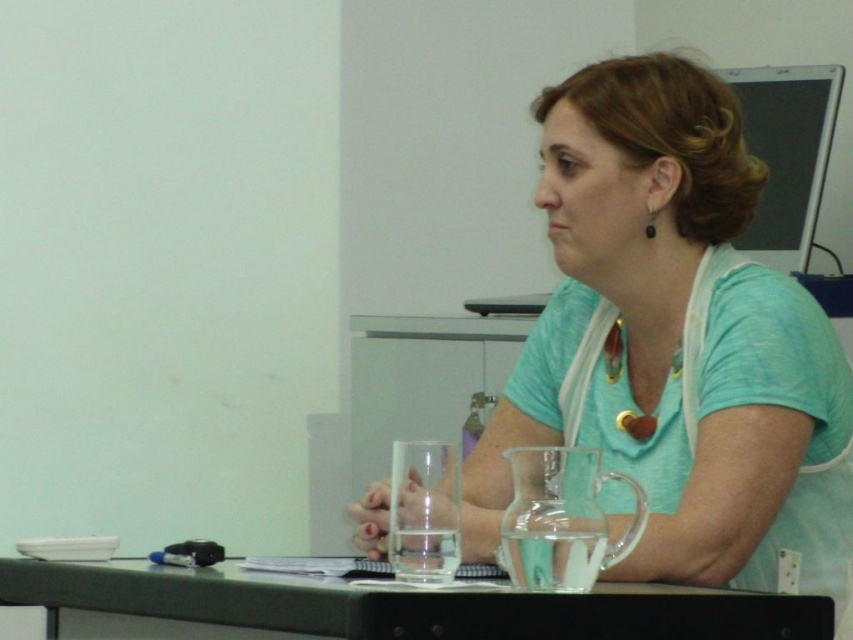
You are an interior designer analyzing the layout of this room. The matte teal shirt at center and the black plastic table at lower center are both important elements. Based on their positions, which object is closer to the right side of the room?

The matte teal shirt at center is to the right of the black plastic table at lower center, so it is closer to the right side of the room.

You are an interior designer analyzing the placement of objects in the scene. What are the coordinates of the matte teal shirt at center?

The coordinates of the matte teal shirt at center are at point (674, 342).

You are designing a layout for a presentation and need to place a matte teal shirt at center and a black plastic table at lower center on a poster. Given their sizes, which object should be placed first to ensure proper scaling?

The matte teal shirt at center should be placed first since it is bigger than the black plastic table at lower center, ensuring proper scaling for both objects.